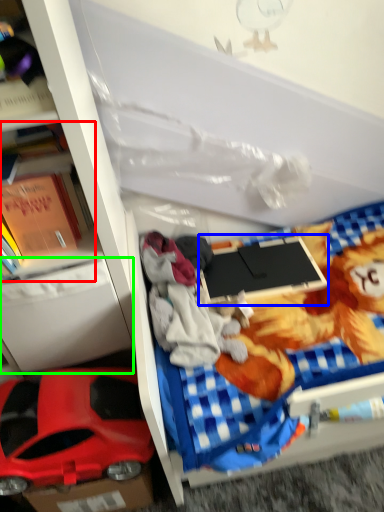
Question: Which object is the closest to the book (highlighted by a red box)? Choose among these: laptop (highlighted by a blue box) or drawer (highlighted by a green box).

Choices:
 (A) laptop
 (B) drawer

Answer: (B)